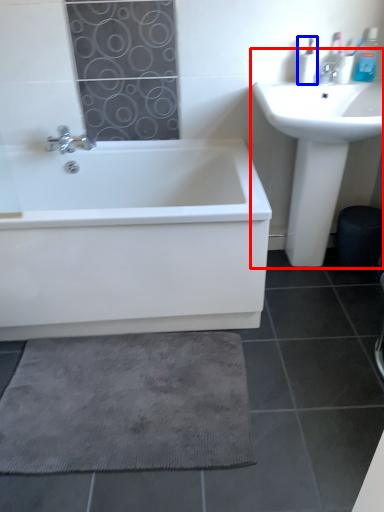
Question: Among these objects, which one is nearest to the camera, sink (highlighted by a red box) or toiletry (highlighted by a blue box)?

Choices:
 (A) sink
 (B) toiletry

Answer: (A)